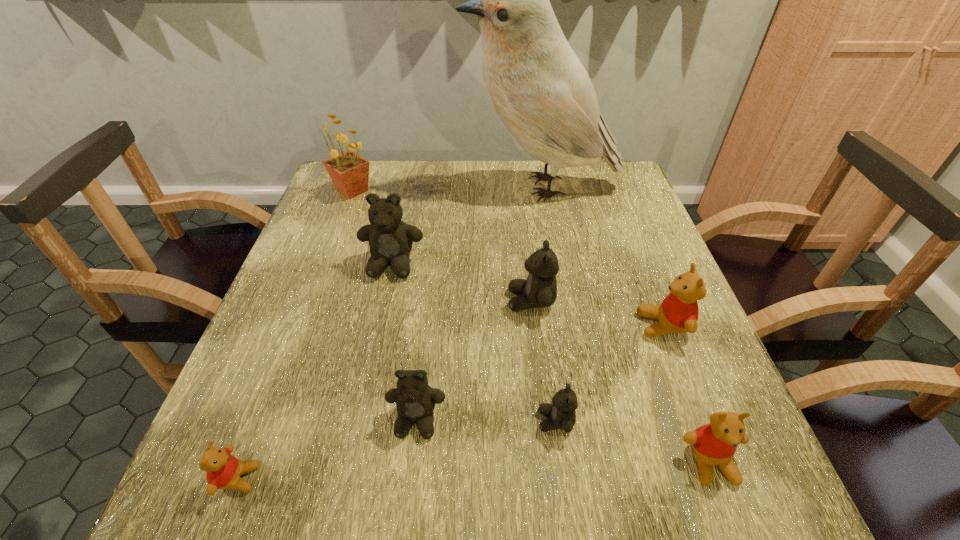
This screenshot has height=540, width=960. I want to click on vacant space at the far right corner of the desktop, so click(x=582, y=170).

Where is `vacant point located between the second tallest object and the smallest red teddy bear`? This screenshot has width=960, height=540. vacant point located between the second tallest object and the smallest red teddy bear is located at coordinates (295, 334).

The image size is (960, 540). In order to click on empty location between the biggest red teddy bear and the second biggest red teddy bear in this screenshot , I will do `click(686, 394)`.

Find the location of a particular element. The width and height of the screenshot is (960, 540). free point between the parakeet and the eighth shortest object is located at coordinates (446, 189).

Image resolution: width=960 pixels, height=540 pixels. In order to click on vacant area that lies between the tallest object and the biggest red teddy bear in this screenshot , I will do `click(602, 256)`.

This screenshot has width=960, height=540. In order to click on empty location between the smallest red teddy bear and the parakeet in this screenshot , I will do `click(389, 333)`.

Locate an element on the screen. The width and height of the screenshot is (960, 540). free area in between the tallest object and the third tallest object is located at coordinates (467, 226).

Where is `free spot between the second biggest red teddy bear and the farthest red teddy bear`? The height and width of the screenshot is (540, 960). free spot between the second biggest red teddy bear and the farthest red teddy bear is located at coordinates (686, 394).

At what (x,y) coordinates should I click in order to perform the action: click on empty space that is in between the second biggest brown teddy bear and the second tallest object. Please return your answer as a coordinate pair (x, y). This screenshot has height=540, width=960. Looking at the image, I should click on (442, 246).

You are a GUI agent. You are given a task and a screenshot of the screen. Output one action in this format:
    pyautogui.click(x=<x>, y=<y>)
    Task: Click on the unoccupied position between the second biggest red teddy bear and the tallest teddy bear
    
    Given the screenshot: What is the action you would take?
    (x=551, y=363)